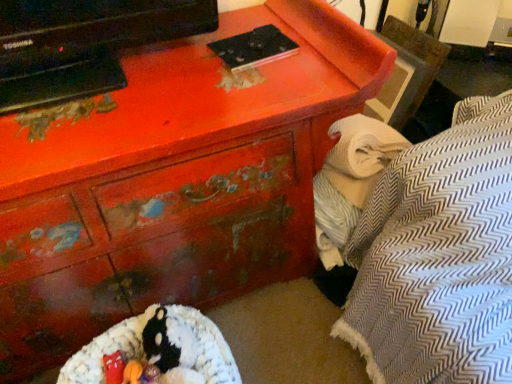
Describe the element at coordinates (350, 180) in the screenshot. The height and width of the screenshot is (384, 512). I see `white textured blanket at right` at that location.

This screenshot has width=512, height=384. I want to click on white textured blanket at right, so click(350, 180).

I want to click on fluffy white bean bag at lower center, so click(159, 349).

Describe the element at coordinates (159, 349) in the screenshot. I see `fluffy white bean bag at lower center` at that location.

Locate an element on the screen. white textured blanket at right is located at coordinates (350, 180).

Considering the positions of objects white textured blanket at right and fluffy white bean bag at lower center in the image provided, who is more to the left, white textured blanket at right or fluffy white bean bag at lower center?

fluffy white bean bag at lower center is more to the left.

Considering the positions of objects white textured blanket at right and fluffy white bean bag at lower center in the image provided, who is behind, white textured blanket at right or fluffy white bean bag at lower center?

white textured blanket at right is further from the camera.

Is point (336, 237) positioned after point (211, 375)?

Yes, it is.

Consider the image. From the image's perspective, which is below, white textured blanket at right or fluffy white bean bag at lower center?

fluffy white bean bag at lower center appears lower in the image.

From a real-world perspective, is white textured blanket at right physically below fluffy white bean bag at lower center?

No, from a real-world perspective, white textured blanket at right is not under fluffy white bean bag at lower center.

Which object is thinner, white textured blanket at right or fluffy white bean bag at lower center?

white textured blanket at right.

Can you confirm if white textured blanket at right is shorter than fluffy white bean bag at lower center?

In fact, white textured blanket at right may be taller than fluffy white bean bag at lower center.

Does white textured blanket at right have a smaller size compared to fluffy white bean bag at lower center?

Yes.

Do you think white textured blanket at right is within fluffy white bean bag at lower center, or outside of it?

white textured blanket at right is spatially situated outside fluffy white bean bag at lower center.

Consider the image. Are white textured blanket at right and fluffy white bean bag at lower center located far from each other?

Actually, white textured blanket at right and fluffy white bean bag at lower center are a little close together.

Based on the photo, is white textured blanket at right oriented away from fluffy white bean bag at lower center?

white textured blanket at right is not turned away from fluffy white bean bag at lower center.

In the scene shown: How far apart are white textured blanket at right and fluffy white bean bag at lower center?

white textured blanket at right and fluffy white bean bag at lower center are 51.82 centimeters apart from each other.

Locate an element on the screen. This screenshot has width=512, height=384. bean bag chair on the left side of white textured blanket at right is located at coordinates (159, 349).

Which object is positioned more to the left, fluffy white bean bag at lower center or white textured blanket at right?

fluffy white bean bag at lower center is more to the left.

Between fluffy white bean bag at lower center and white textured blanket at right, which one is positioned in front?

fluffy white bean bag at lower center is closer to the camera.

Does point (177, 331) lie behind point (364, 170)?

No, it is in front of (364, 170).

From the image's perspective, would you say fluffy white bean bag at lower center is positioned over white textured blanket at right?

Incorrect, from the image's perspective, fluffy white bean bag at lower center is lower than white textured blanket at right.

From a real-world perspective, is fluffy white bean bag at lower center located beneath white textured blanket at right?

Yes, from a real-world perspective, fluffy white bean bag at lower center is below white textured blanket at right.

Between fluffy white bean bag at lower center and white textured blanket at right, which one has smaller width?

With smaller width is white textured blanket at right.

Who is shorter, fluffy white bean bag at lower center or white textured blanket at right?

fluffy white bean bag at lower center is shorter.

Which of these two, fluffy white bean bag at lower center or white textured blanket at right, is smaller?

white textured blanket at right is smaller.

Do you think fluffy white bean bag at lower center is within white textured blanket at right, or outside of it?

fluffy white bean bag at lower center is not inside white textured blanket at right, it's outside.

Based on the photo, can you see fluffy white bean bag at lower center touching white textured blanket at right?

No, fluffy white bean bag at lower center is not beside white textured blanket at right.

Could you tell me if fluffy white bean bag at lower center is facing white textured blanket at right?

No, fluffy white bean bag at lower center does not turn towards white textured blanket at right.

How many degrees apart are the facing directions of fluffy white bean bag at lower center and white textured blanket at right?

The angular difference between fluffy white bean bag at lower center and white textured blanket at right is 1.27 degrees.

How distant is fluffy white bean bag at lower center from white textured blanket at right?

fluffy white bean bag at lower center is 20.40 inches from white textured blanket at right.

In the image, there is a white textured blanket at right. Where is `bean bag chair below it (from a real-world perspective)`? bean bag chair below it (from a real-world perspective) is located at coordinates (159, 349).

Locate an element on the screen. bean bag chair that is under the white textured blanket at right (from a real-world perspective) is located at coordinates (159, 349).

Where is `bean bag chair located below the white textured blanket at right (from the image's perspective)`? This screenshot has height=384, width=512. bean bag chair located below the white textured blanket at right (from the image's perspective) is located at coordinates (159, 349).